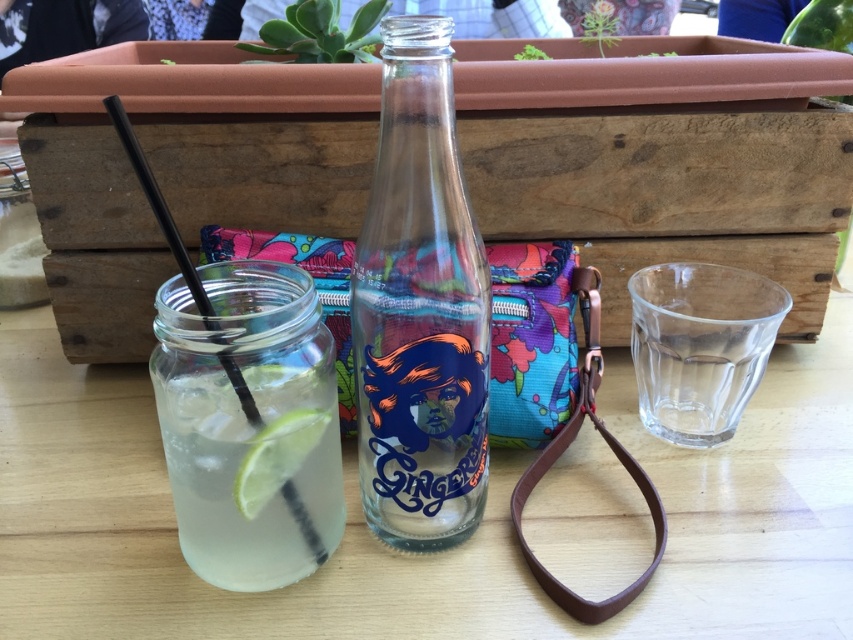
You are a customer at the outdoor table and want to reach both the wooden crate at center and the brown leather strap at center. Which item will you need to reach over first?

You will need to reach over the wooden crate at center first because it is closer to you than the brown leather strap at center, which is further away.